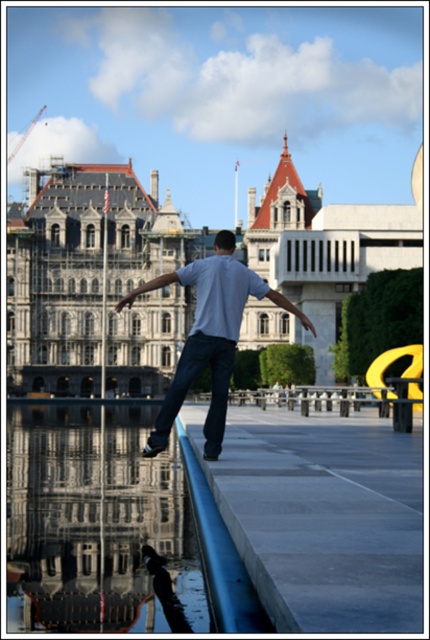
You are an architect inspecting the historic building. You notice the clear glass water at lower left and denim jeans at center in the foreground. Which object occupies more horizontal space in the image?

The clear glass water at lower left is wider than denim jeans at center, so it occupies more horizontal space in the image.

You are standing in front of the historic building and want to take a photo of the clear glass water at lower left. Where should you position yourself to capture it in the frame?

You should position yourself at point (95, 522) to capture the clear glass water at lower left in the frame.